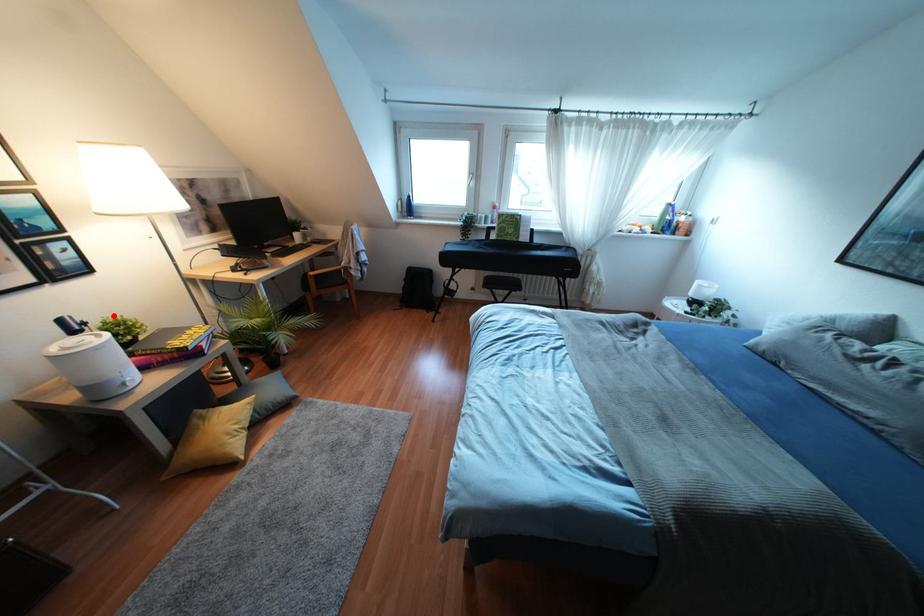
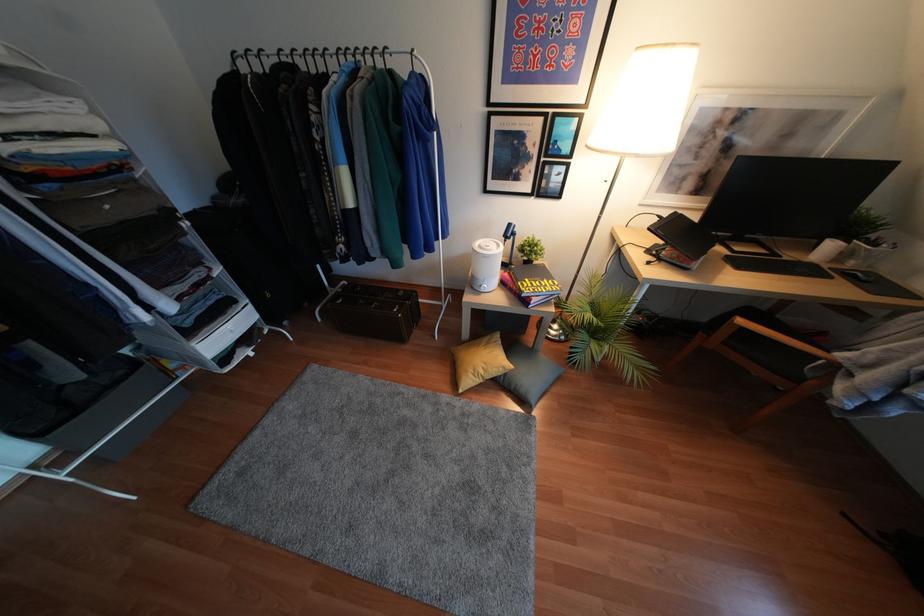
Where in the second image is the point corresponding to the highlighted location from the first image?

(536, 237)